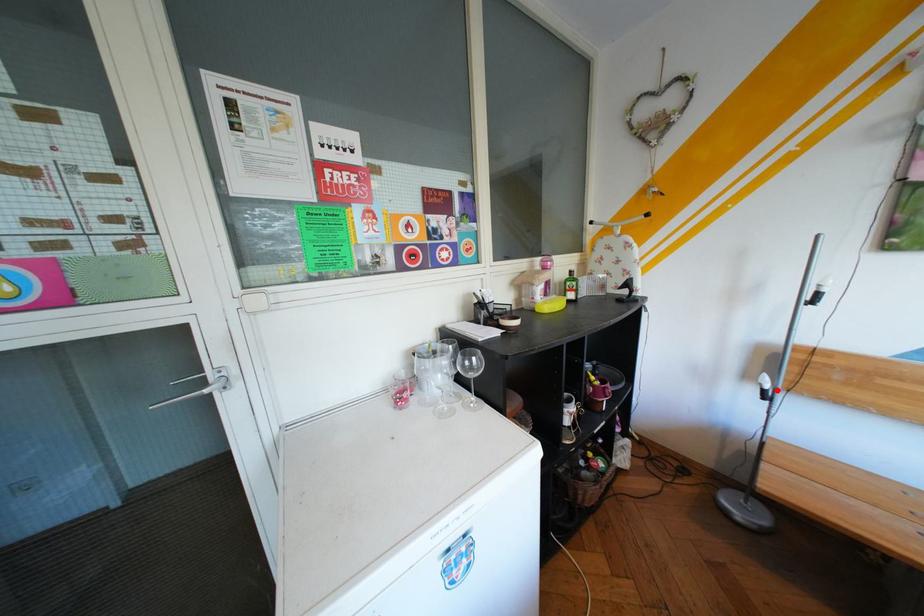
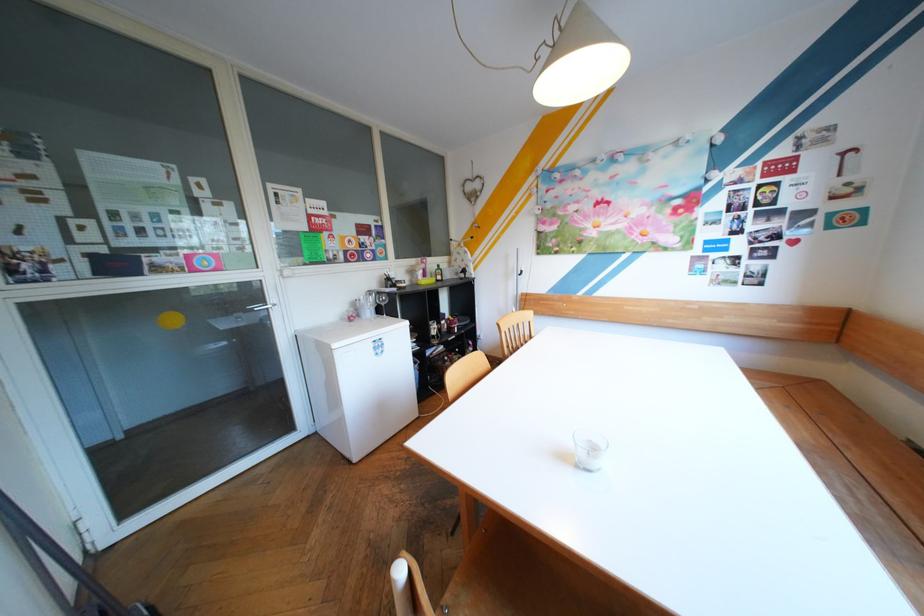
Question: I am providing you with two images of the same scene from different viewpoints. A red point is marked on the first image. Can you still see the location of the red point in image 2?

Choices:
 (A) Yes
 (B) No

Answer: (B)